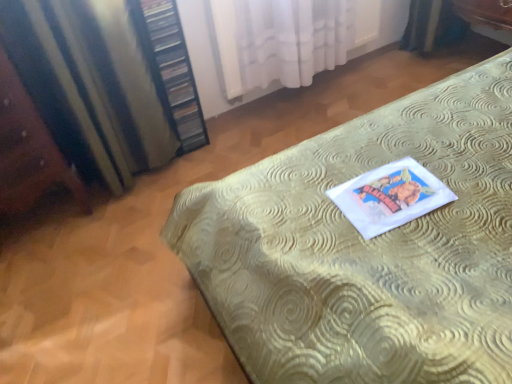
Where is `vacant space in front of satin striped curtain at left, which is the 1th curtain in left-to-right order`? vacant space in front of satin striped curtain at left, which is the 1th curtain in left-to-right order is located at coordinates (121, 229).